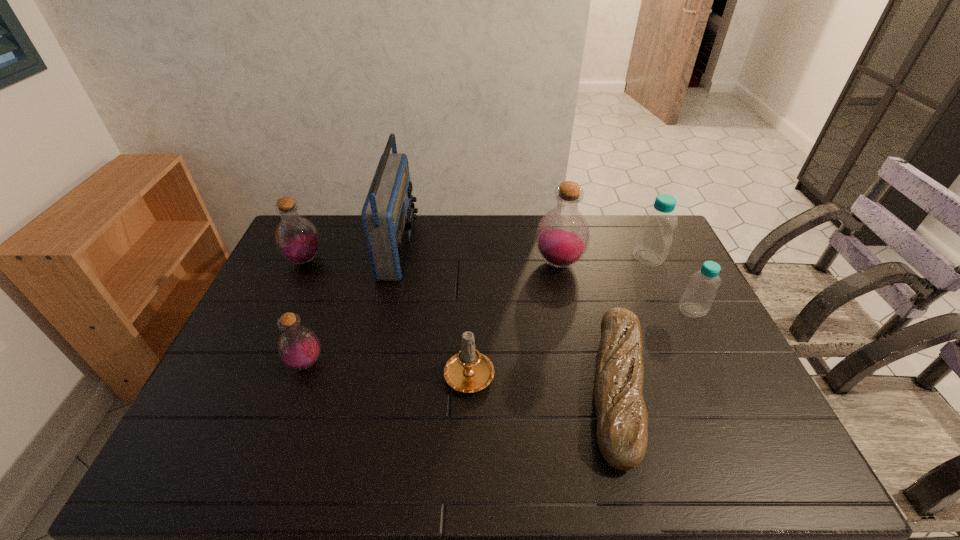
Image resolution: width=960 pixels, height=540 pixels. In order to click on the second purple bottle from left to right in this screenshot , I will do [x=298, y=347].

The height and width of the screenshot is (540, 960). Identify the location of candle. (468, 371).

The height and width of the screenshot is (540, 960). Find the location of `baguet`. baguet is located at coordinates (622, 419).

You are a GUI agent. You are given a task and a screenshot of the screen. Output one action in this format:
    pyautogui.click(x=<x>, y=<y>)
    Task: Click on the vacant space located on the front panel of the blue radio receiver
    This screenshot has width=960, height=540.
    Given the screenshot: What is the action you would take?
    pyautogui.click(x=462, y=247)

Where is `blank area located on the right of the biggest purple bottle`? The image size is (960, 540). blank area located on the right of the biggest purple bottle is located at coordinates (651, 263).

Locate an element on the screen. free spot located on the left of the bigger blue bottle is located at coordinates pos(598,258).

Image resolution: width=960 pixels, height=540 pixels. In order to click on vacant space situated on the front of the leftmost object in this screenshot , I will do `click(289, 295)`.

You are a GUI agent. You are given a task and a screenshot of the screen. Output one action in this format:
    pyautogui.click(x=<x>, y=<y>)
    Task: Click on the vacant space situated on the back of the fifth farthest object
    
    Given the screenshot: What is the action you would take?
    coord(669,263)

Identify the location of free region located 0.290m on the back of the second purple bottle from right to left. (336, 279).

What are the coordinates of `vacant space located 0.110m on the front of the candle` in the screenshot? It's located at (468, 438).